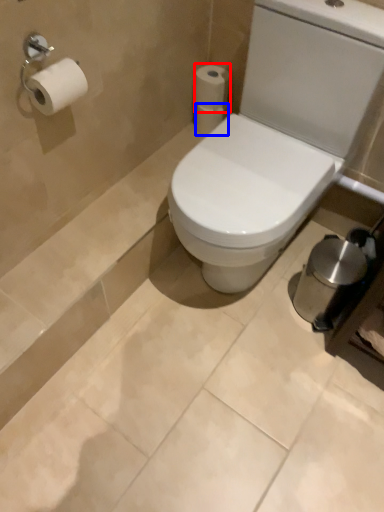
Question: Which point is further to the camera, toilet paper (highlighted by a red box) or toilet paper (highlighted by a blue box)?

Choices:
 (A) toilet paper
 (B) toilet paper

Answer: (B)